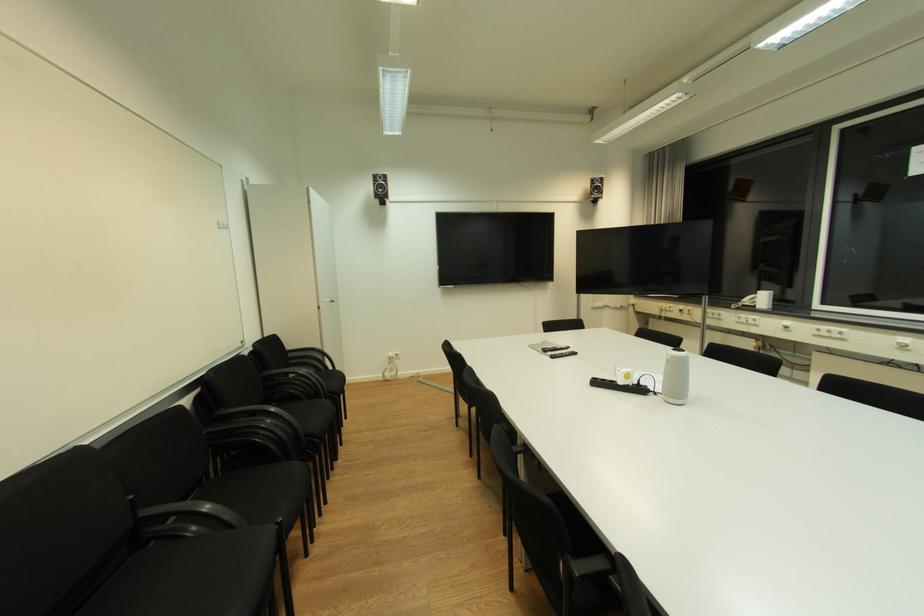
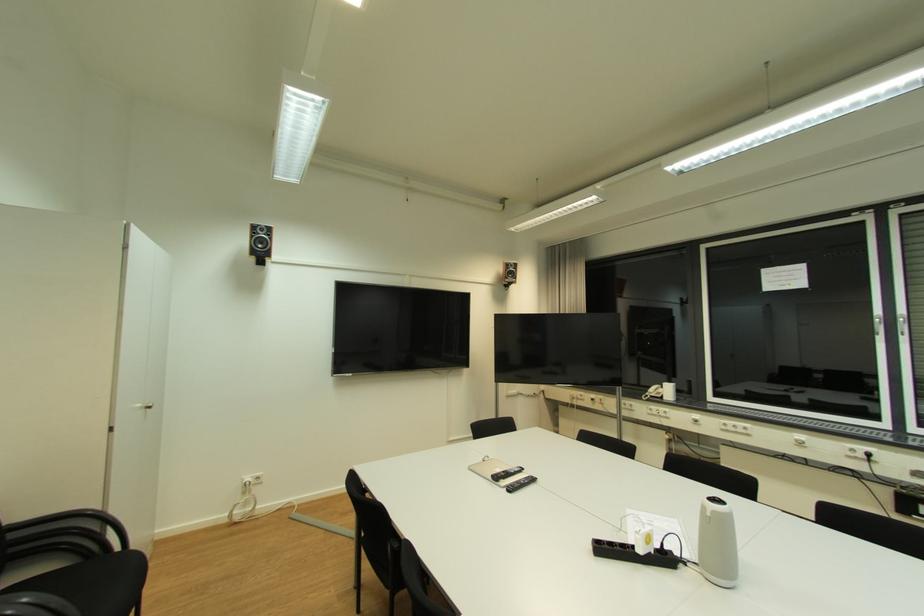
The point at (334, 301) is marked in the first image. Where is the corresponding point in the second image?

(146, 407)